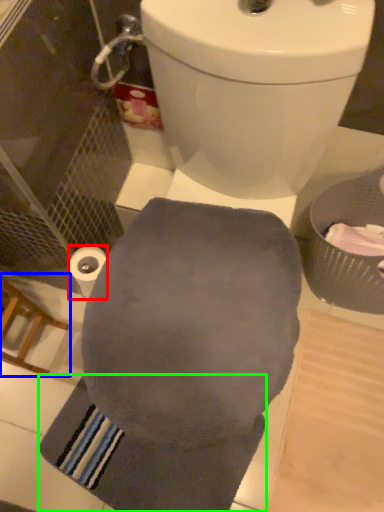
Question: Which object is the farthest from toilet paper (highlighted by a red box)? Choose among these: chair (highlighted by a blue box) or bath towel (highlighted by a green box).

Choices:
 (A) chair
 (B) bath towel

Answer: (B)